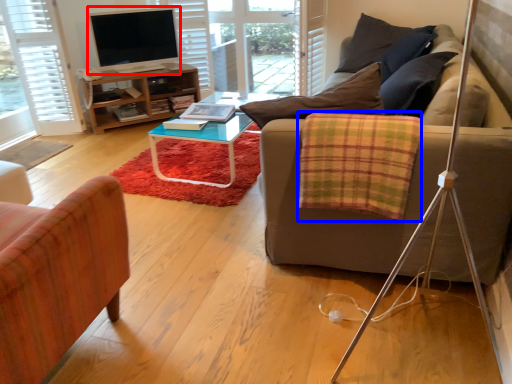
Question: Which object is further to the camera taking this photo, television (highlighted by a red box) or blanket (highlighted by a blue box)?

Choices:
 (A) television
 (B) blanket

Answer: (A)